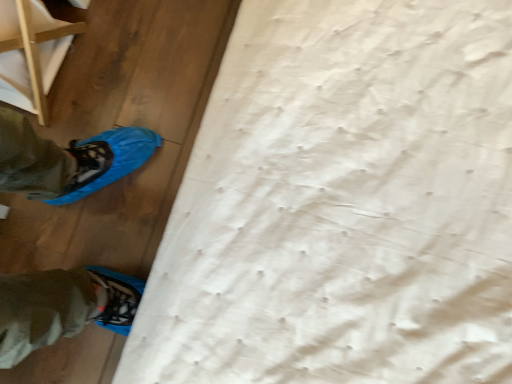
Identify the location of vacant point to the right of wooden chair at upper left. (132, 47).